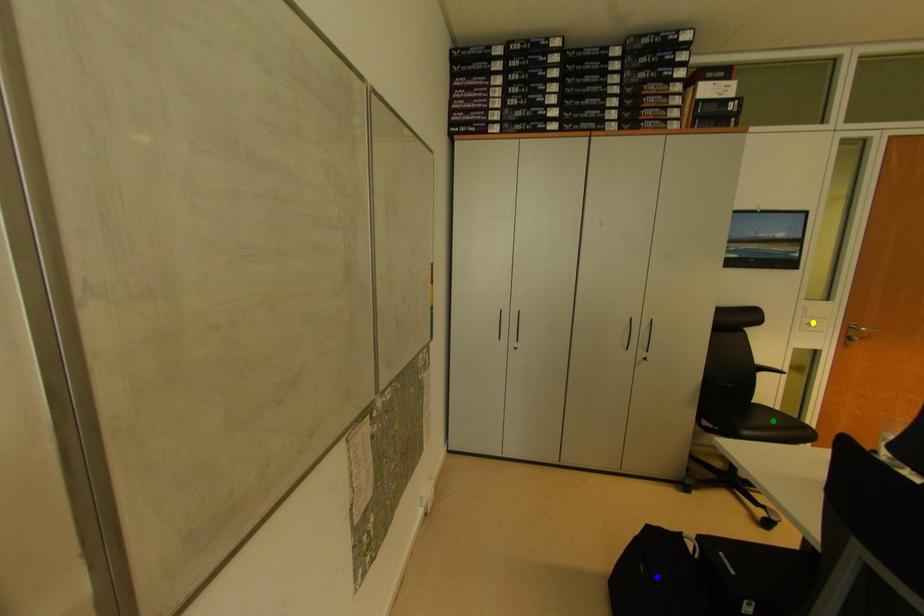
Order these from nearest to farthest:
A) green point
B) yellow point
C) blue point

green point → yellow point → blue point